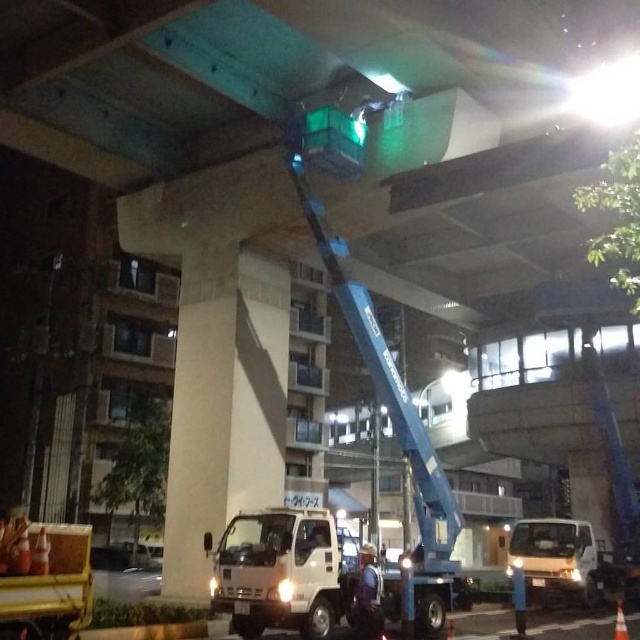
Question: Can you confirm if white matte truck at lower center is positioned below reflective silver vest at center?

Choices:
 (A) no
 (B) yes

Answer: (A)

Question: Among these objects, which one is nearest to the camera?

Choices:
 (A) white matte truck at lower center
 (B) reflective silver vest at center

Answer: (A)

Question: Which point is closer to the camera taking this photo?

Choices:
 (A) (225, 611)
 (B) (524, 576)

Answer: (A)

Question: Does white matte truck at lower center have a greater width compared to reflective silver vest at center?

Choices:
 (A) no
 (B) yes

Answer: (B)

Question: Does white matte truck at lower center appear under reflective silver vest at center?

Choices:
 (A) no
 (B) yes

Answer: (A)

Question: Considering the real-world distances, which object is closest to the reflective silver vest at center?

Choices:
 (A) white matte truck at lower right
 (B) orange reflective cone at lower right
 (C) white matte truck at lower center

Answer: (C)